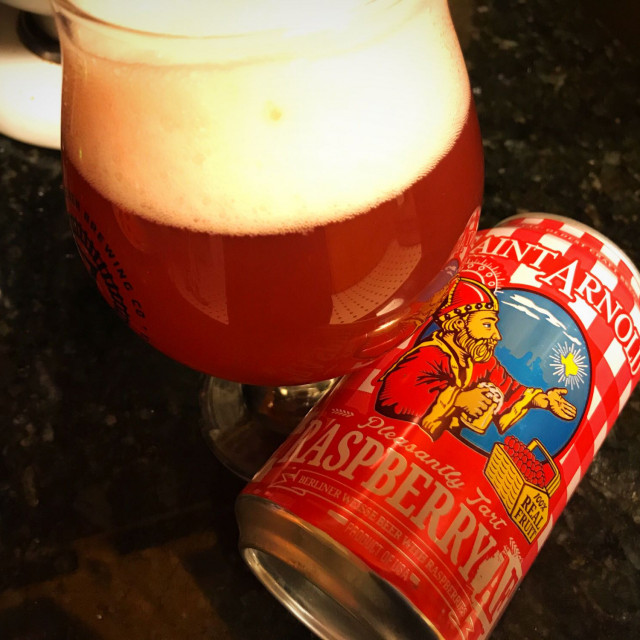
I want to click on tabletop, so click(539, 176).